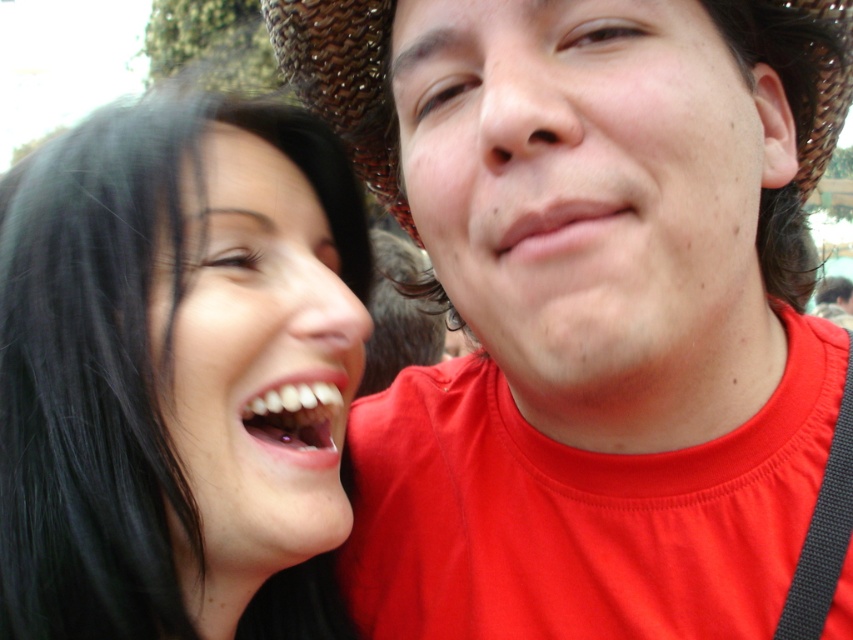
Question: Is black hair at left closer to the viewer compared to white glossy teeth at center?

Choices:
 (A) yes
 (B) no

Answer: (A)

Question: Which point is closer to the camera?

Choices:
 (A) matte black hair at left
 (B) matte pink lips at center
 (C) black hair at left

Answer: (C)

Question: Which object appears farthest from the camera in this image?

Choices:
 (A) matte black hair at left
 (B) black hair at left

Answer: (A)

Question: Is matte red shirt at right below smooth skin face at center?

Choices:
 (A) yes
 (B) no

Answer: (A)

Question: Which point is farther to the camera?

Choices:
 (A) (374, 163)
 (B) (560, 384)
 (C) (721, 492)

Answer: (A)

Question: Is the position of black hair at left less distant than that of matte black hair at left?

Choices:
 (A) yes
 (B) no

Answer: (A)